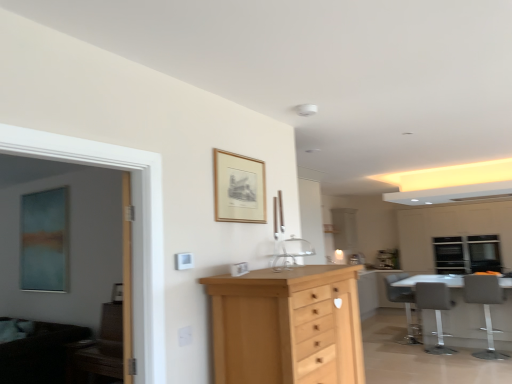
Question: Based on their sizes in the image, would you say gray fabric chair at lower right, the first chair from the front, is bigger or smaller than white glossy cabinetry at right?

Choices:
 (A) big
 (B) small

Answer: (B)

Question: From a real-world perspective, is gray fabric chair at lower right, the first chair from the front, positioned above or below white glossy cabinetry at right?

Choices:
 (A) below
 (B) above

Answer: (A)

Question: Considering the real-world distances, which object is farthest from the clear glass sink at center?

Choices:
 (A) transparent glass window at upper right
 (B) gray fabric chair at lower right, the first chair from the front
 (C) gray fabric chair at right, the 1th chair from the back
 (D) wooden picture frame at upper center
 (E) white glossy table at lower right

Answer: (A)

Question: Estimate the real-world distances between objects in this image. Which object is farther from the gray fabric chair at lower right, the first chair from the front?

Choices:
 (A) gray fabric chair at right, the 1th chair from the back
 (B) light wood chest of drawers at center
 (C) clear glass sink at center
 (D) wooden picture frame at upper center
 (E) matte gray chair at lower right, arranged as the 2th chair when viewed from the front

Answer: (D)